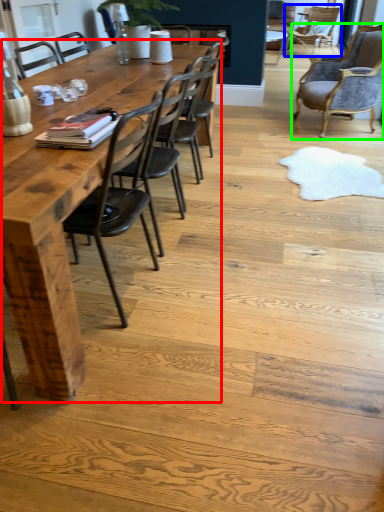
Question: Which object is the farthest from kitchen & dining room table (highlighted by a red box)? Choose among these: chair (highlighted by a blue box) or chair (highlighted by a green box).

Choices:
 (A) chair
 (B) chair

Answer: (A)